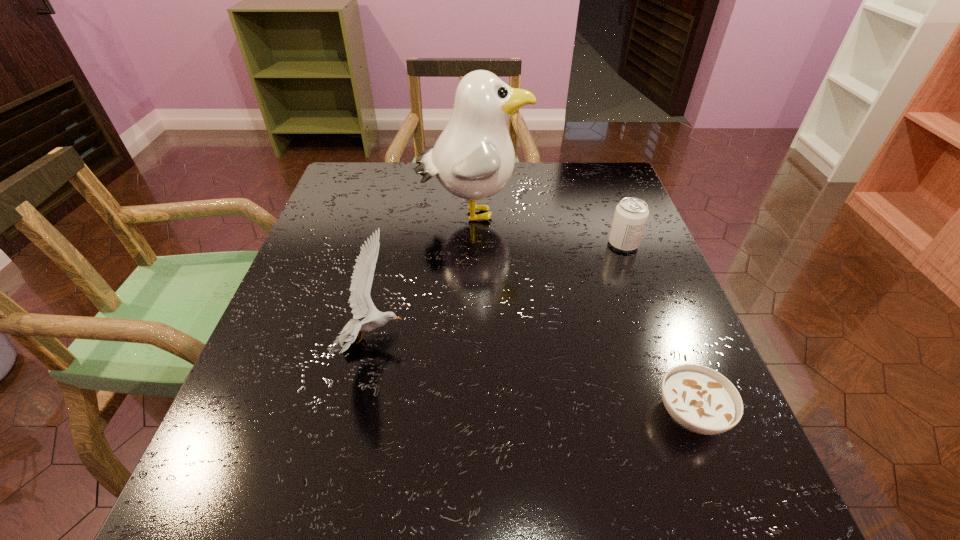
Identify the location of the closest object to the second shortest object. point(473,158).

Identify which object is located as the nearest to the soda can. Please provide its 2D coordinates. Your answer should be formatted as a tuple, i.e. [(x, y)], where the tuple contains the x and y coordinates of a point satisfying the conditions above.

[(473, 158)]

Image resolution: width=960 pixels, height=540 pixels. In order to click on blank area in the image that satisfies the following two spatial constraints: 1. on the beak of the farther gull; 2. on the left side of the shortest object in this screenshot , I will do pos(469,414).

The width and height of the screenshot is (960, 540). Identify the location of vacant space that satisfies the following two spatial constraints: 1. on the beak of the tallest object; 2. on the right side of the third tallest object. (472, 244).

Where is `vacant space that satisfies the following two spatial constraints: 1. on the beak of the farther gull; 2. on the back side of the shortest object`? This screenshot has width=960, height=540. vacant space that satisfies the following two spatial constraints: 1. on the beak of the farther gull; 2. on the back side of the shortest object is located at coordinates (469, 414).

Locate an element on the screen. Image resolution: width=960 pixels, height=540 pixels. vacant space that satisfies the following two spatial constraints: 1. at the tip of the beak of the second tallest object; 2. on the left side of the soup bowl is located at coordinates (356, 414).

The width and height of the screenshot is (960, 540). I want to click on vacant area that satisfies the following two spatial constraints: 1. on the back side of the soup bowl; 2. on the beak of the tallest object, so click(x=614, y=213).

Locate an element on the screen. vacant region that satisfies the following two spatial constraints: 1. at the tip of the beak of the shortest object; 2. on the right side of the shorter gull is located at coordinates (356, 414).

In order to click on vacant space that satisfies the following two spatial constraints: 1. on the beak of the tallest object; 2. on the left side of the soda can in this screenshot , I will do `click(472, 244)`.

Locate an element on the screen. The height and width of the screenshot is (540, 960). free space that satisfies the following two spatial constraints: 1. on the beak of the soda can; 2. on the left side of the tallest object is located at coordinates (472, 244).